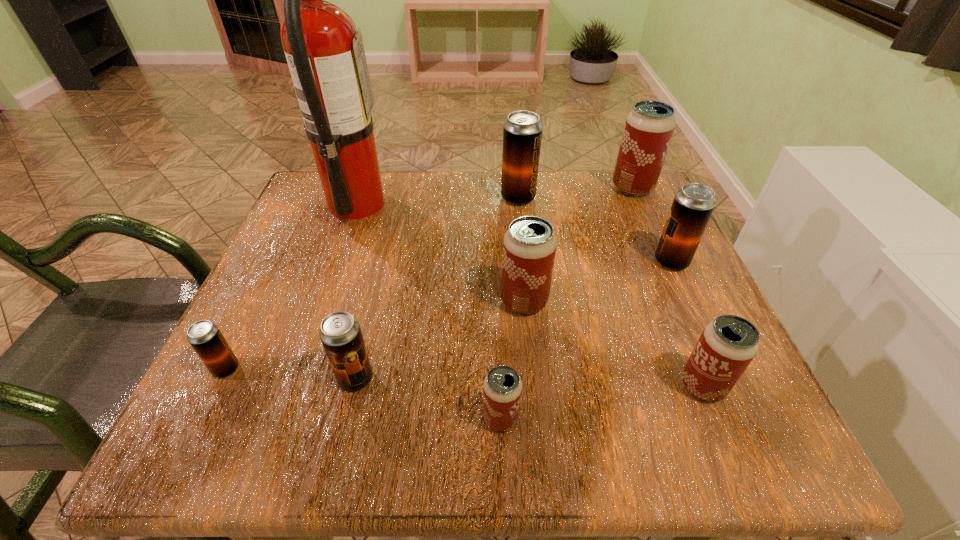
The image size is (960, 540). I want to click on vacant space at the far edge of the desktop, so click(556, 224).

Locate an element on the screen. This screenshot has width=960, height=540. vacant region at the left edge of the desktop is located at coordinates (233, 336).

The height and width of the screenshot is (540, 960). In order to click on free region at the right edge in this screenshot , I will do `click(634, 268)`.

In the image, there is a desktop. Where is `blank space at the far left corner`? The width and height of the screenshot is (960, 540). blank space at the far left corner is located at coordinates (300, 228).

You are a GUI agent. You are given a task and a screenshot of the screen. Output one action in this format:
    pyautogui.click(x=<x>, y=<y>)
    Task: Click on the vacant region at the near right corner
    The height and width of the screenshot is (540, 960).
    Given the screenshot: What is the action you would take?
    pyautogui.click(x=758, y=424)

You are a GUI agent. You are given a task and a screenshot of the screen. Output one action in this format:
    pyautogui.click(x=<x>, y=<y>)
    Task: Click on the free area in between the smallest red beer can and the third biggest black beer can
    The height and width of the screenshot is (540, 960).
    Given the screenshot: What is the action you would take?
    pyautogui.click(x=428, y=398)

The height and width of the screenshot is (540, 960). Find the location of `free space between the third black beer can from right to left and the fire extinguisher`. free space between the third black beer can from right to left and the fire extinguisher is located at coordinates (356, 291).

Identify the location of unoccupied area between the smallest black beer can and the farthest black beer can. (372, 284).

In order to click on empty location between the third biggest red beer can and the second biggest black beer can in this screenshot , I will do `click(687, 323)`.

Locate an element on the screen. The image size is (960, 540). vacant area that lies between the farthest black beer can and the red fire extinguisher is located at coordinates (437, 201).